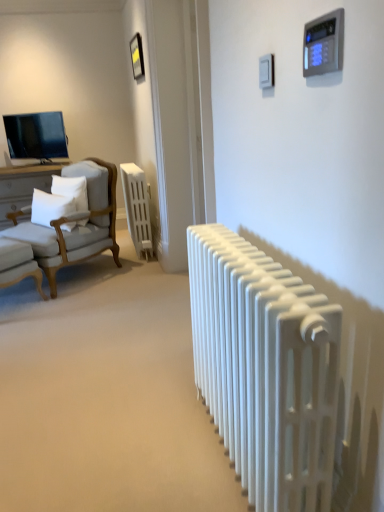
Question: Is metallic gold picture frame at upper center further to the viewer compared to white matte radiator at center, which is the first radiator in back-to-front order?

Choices:
 (A) no
 (B) yes

Answer: (A)

Question: Does metallic gold picture frame at upper center have a larger size compared to white matte radiator at center, which is the first radiator in back-to-front order?

Choices:
 (A) yes
 (B) no

Answer: (B)

Question: Is metallic gold picture frame at upper center positioned with its back to white matte radiator at center, which is the first radiator in back-to-front order?

Choices:
 (A) yes
 (B) no

Answer: (B)

Question: Is metallic gold picture frame at upper center facing towards white matte radiator at center, which is counted as the second radiator, starting from the right?

Choices:
 (A) no
 (B) yes

Answer: (A)

Question: Considering the relative sizes of metallic gold picture frame at upper center and white matte radiator at center, which appears as the first radiator when viewed from the left, in the image provided, is metallic gold picture frame at upper center taller than white matte radiator at center, which appears as the first radiator when viewed from the left,?

Choices:
 (A) no
 (B) yes

Answer: (A)

Question: From a real-world perspective, is metallic gold picture frame at upper center above or below white soft pillow at left, the 1th pillow viewed from the left?

Choices:
 (A) below
 (B) above

Answer: (B)

Question: In terms of width, does metallic gold picture frame at upper center look wider or thinner when compared to white soft pillow at left, the 1th pillow viewed from the left?

Choices:
 (A) thin
 (B) wide

Answer: (A)

Question: Is metallic gold picture frame at upper center taller or shorter than white soft pillow at left, which ranks as the 2th pillow in right-to-left order?

Choices:
 (A) short
 (B) tall

Answer: (A)

Question: From the image's perspective, is metallic gold picture frame at upper center positioned above or below white soft pillow at left, which ranks as the 2th pillow in right-to-left order?

Choices:
 (A) above
 (B) below

Answer: (A)

Question: From a real-world perspective, relative to white soft pillow at left, the 1th pillow viewed from the left, is white matte radiator at center, the second radiator from the left, vertically above or below?

Choices:
 (A) above
 (B) below

Answer: (B)

Question: Considering the positions of white matte radiator at center, the 1th radiator when ordered from front to back, and white soft pillow at left, the 1th pillow viewed from the left, in the image, is white matte radiator at center, the 1th radiator when ordered from front to back, bigger or smaller than white soft pillow at left, the 1th pillow viewed from the left,?

Choices:
 (A) big
 (B) small

Answer: (A)

Question: Does point (240, 271) appear closer or farther from the camera than point (69, 208)?

Choices:
 (A) closer
 (B) farther

Answer: (A)

Question: Relative to white soft pillow at left, the 1th pillow viewed from the left, is white matte radiator at center, the second radiator from the left, in front or behind?

Choices:
 (A) behind
 (B) front

Answer: (B)

Question: Looking at their shapes, would you say light gray fabric chair at left, positioned as the second chair in bottom-to-top order, is wider or thinner than white fabric chair at left, which is counted as the 2th chair, starting from the top?

Choices:
 (A) thin
 (B) wide

Answer: (B)

Question: Looking at the image, does light gray fabric chair at left, marked as the first chair in a top-to-bottom arrangement, seem bigger or smaller compared to white fabric chair at left, the 1th chair in the bottom-to-top sequence?

Choices:
 (A) small
 (B) big

Answer: (B)